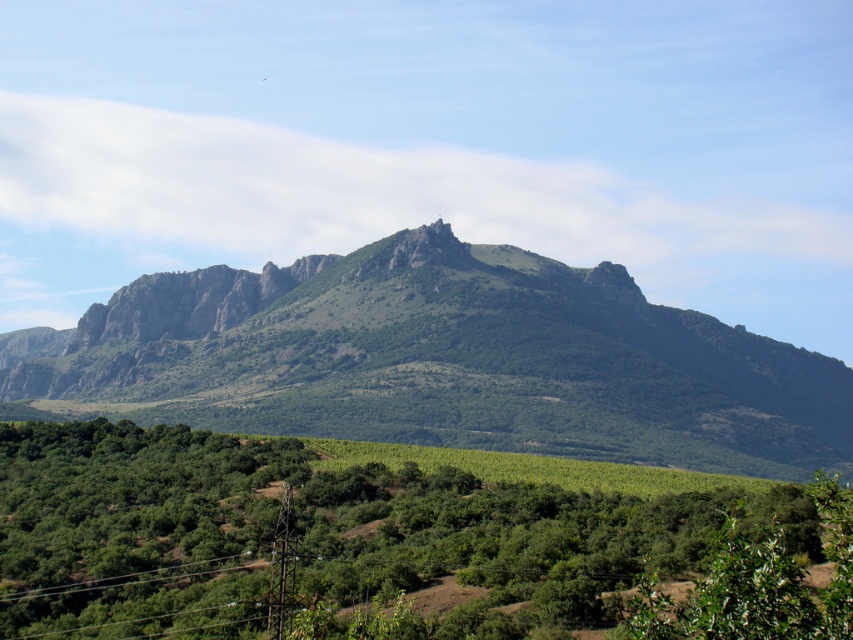
Question: Can you confirm if green leafy tree at center is positioned above green textured mountain at center?

Choices:
 (A) no
 (B) yes

Answer: (A)

Question: Which object appears farthest from the camera in this image?

Choices:
 (A) green textured mountain at center
 (B) green leafy tree at center

Answer: (A)

Question: Where is green leafy tree at center located in relation to green textured mountain at center in the image?

Choices:
 (A) right
 (B) left

Answer: (A)

Question: Which point is closer to the camera taking this photo?

Choices:
 (A) 575,417
 (B) 107,621

Answer: (B)

Question: Which point is farther to the camera?

Choices:
 (A) pos(445,310)
 (B) pos(364,564)

Answer: (A)

Question: Can you confirm if green leafy tree at center is smaller than green textured mountain at center?

Choices:
 (A) yes
 (B) no

Answer: (A)